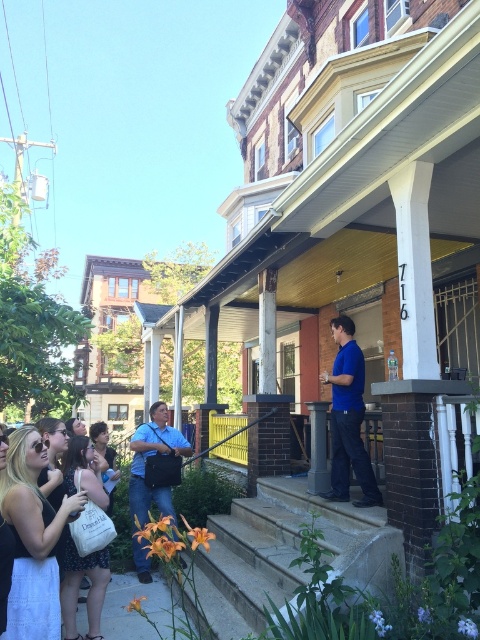
Question: Among these objects, which one is nearest to the camera?

Choices:
 (A) white cotton dress at lower left
 (B) concrete stairs at center
 (C) blue fabric bag at lower left
 (D) smooth gray column at center

Answer: (A)

Question: From the image, what is the correct spatial relationship of blue fabric bag at lower left in relation to smooth gray column at center?

Choices:
 (A) above
 (B) below

Answer: (B)

Question: Estimate the real-world distances between objects in this image. Which object is farther from the blue fabric bag at lower left?

Choices:
 (A) concrete stairs at center
 (B) white cotton dress at lower left

Answer: (B)

Question: Can you confirm if white cotton dress at lower left is smaller than blue smooth shirt at center?

Choices:
 (A) no
 (B) yes

Answer: (B)

Question: Which object is farther from the camera taking this photo?

Choices:
 (A) blue smooth shirt at center
 (B) white cotton dress at lower left

Answer: (A)

Question: Can you confirm if concrete stairs at center is positioned to the left of smooth gray column at center?

Choices:
 (A) yes
 (B) no

Answer: (A)